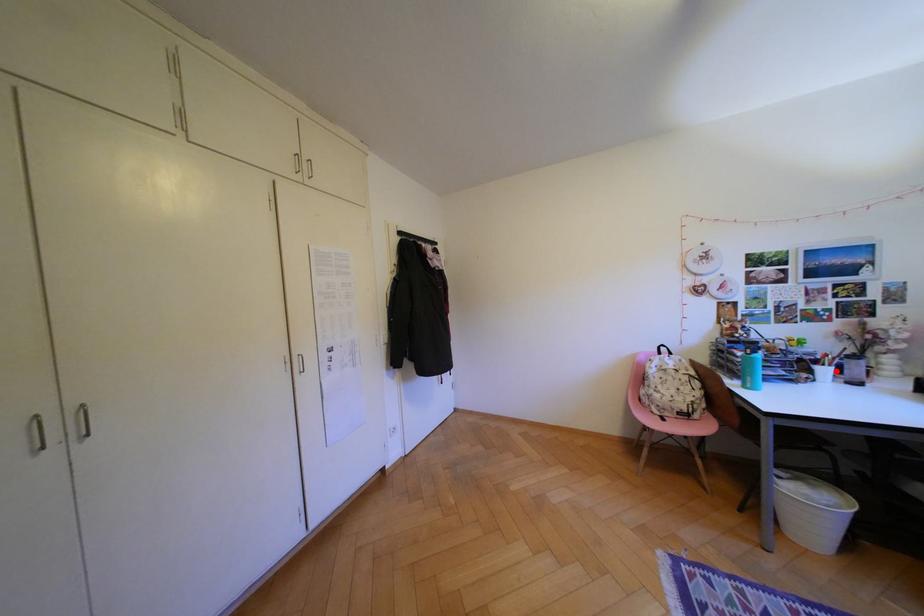
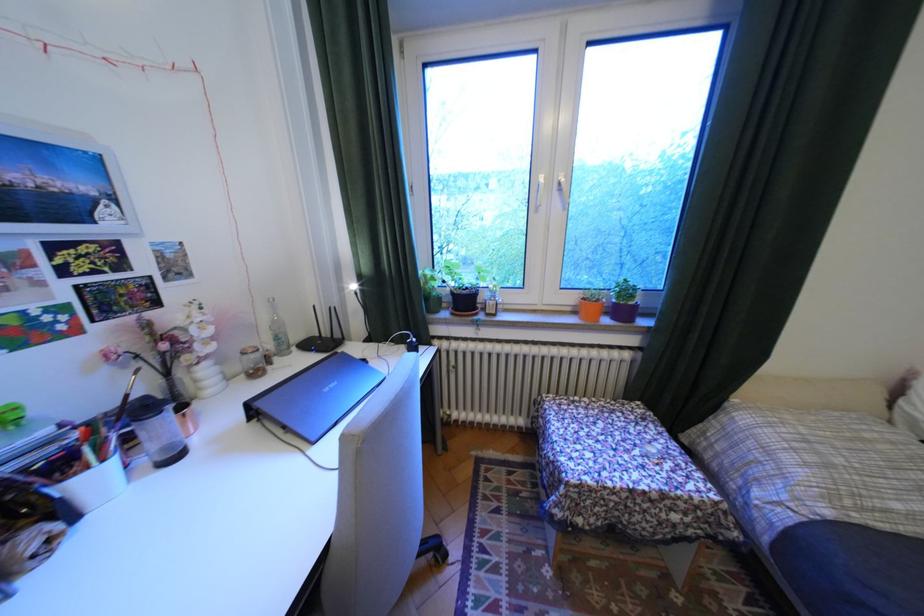
The point at the highlighted location is marked in the first image. Where is the corresponding point in the second image?

(106, 479)